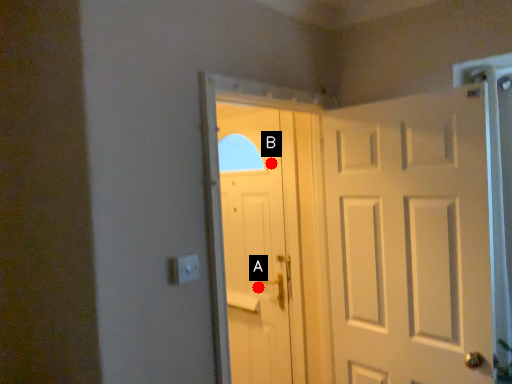
Question: Two points are circled on the image, labeled by A and B beside each circle. Among these points, which one is nearest to the camera?

Choices:
 (A) A is closer
 (B) B is closer

Answer: (B)